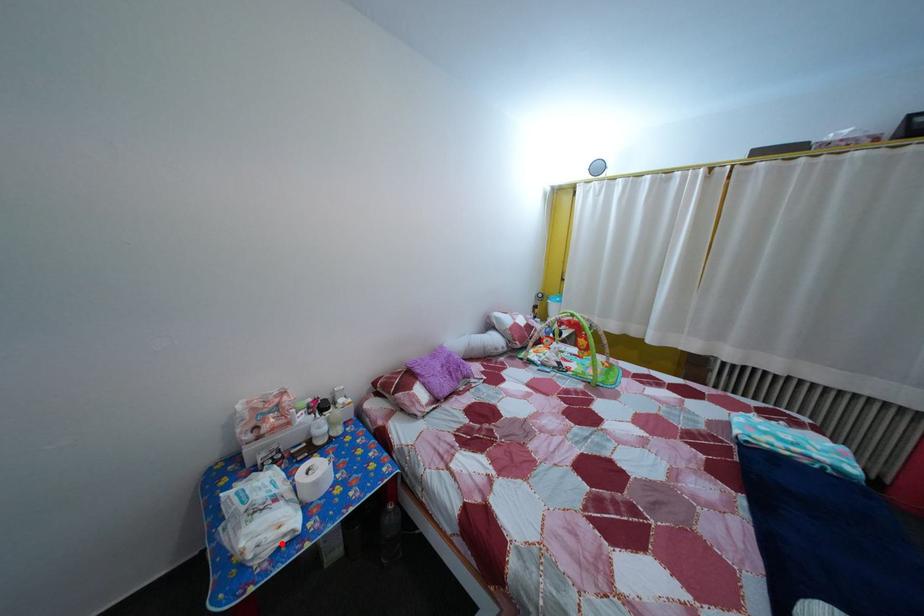
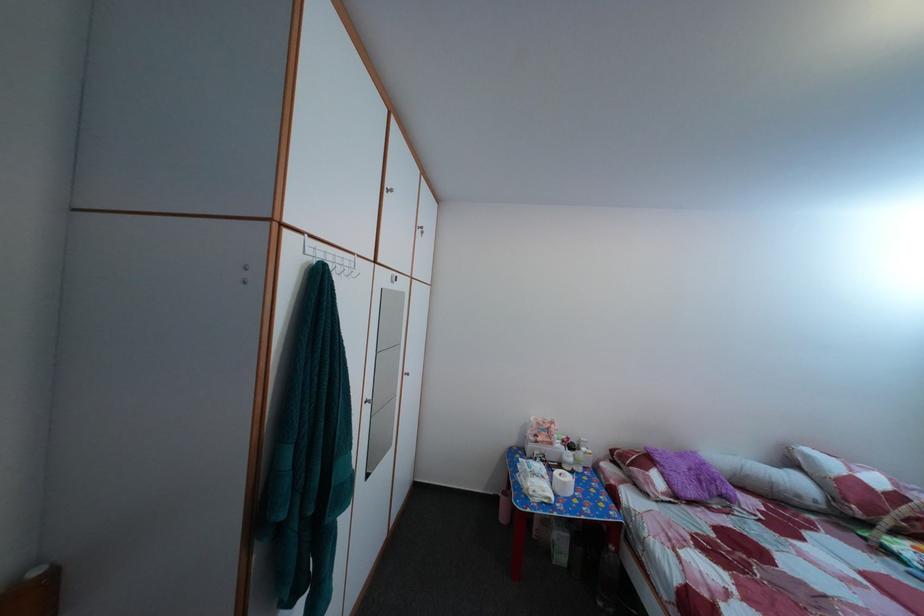
The point at the highlighted location is marked in the first image. Where is the corresponding point in the second image?

(551, 500)